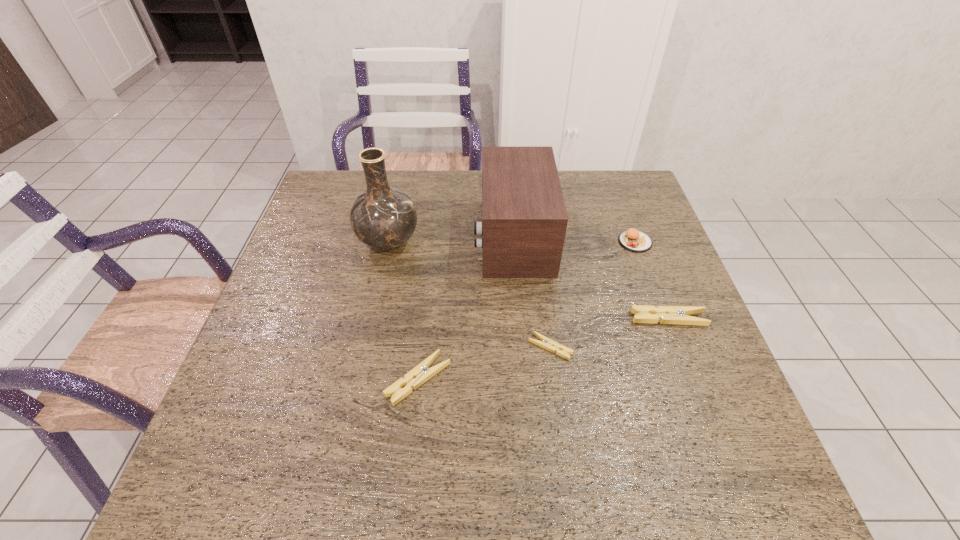
This screenshot has width=960, height=540. Find the location of `free point that keeps the clothespins evenly spaced on the left`. free point that keeps the clothespins evenly spaced on the left is located at coordinates (269, 415).